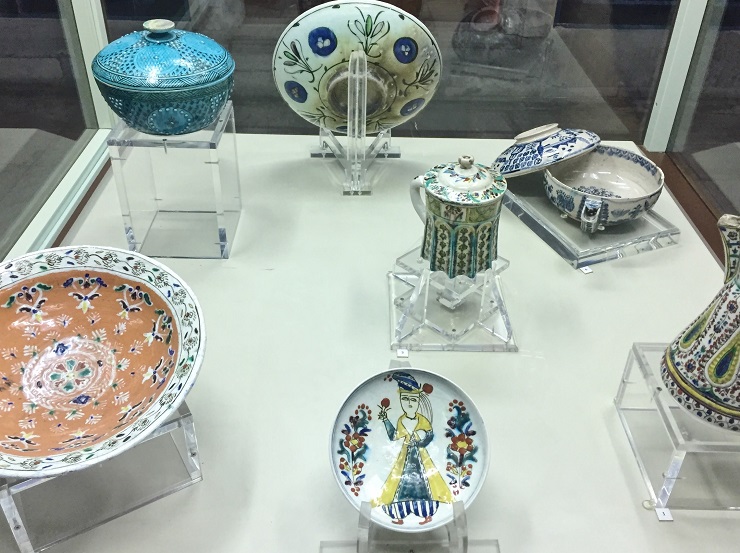
Image resolution: width=740 pixels, height=553 pixels. Identify the location of bowl. (639, 197).